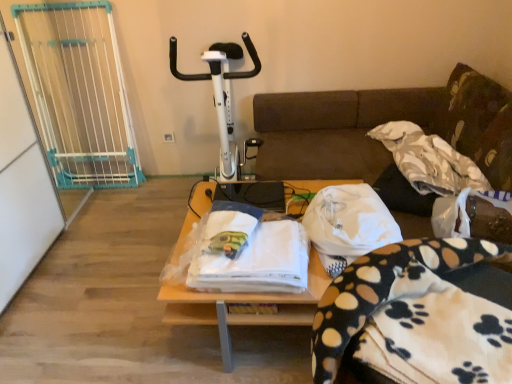
Question: Is the position of white plastic exercise bike at center more distant than that of white fabric at center?

Choices:
 (A) yes
 (B) no

Answer: (A)

Question: From the image's perspective, does white plastic exercise bike at center appear higher than white fabric at center?

Choices:
 (A) no
 (B) yes

Answer: (B)

Question: Is white plastic exercise bike at center outside of white fabric at center?

Choices:
 (A) yes
 (B) no

Answer: (A)

Question: Is white plastic exercise bike at center turned away from white fabric at center?

Choices:
 (A) yes
 (B) no

Answer: (B)

Question: Considering the relative sizes of white plastic exercise bike at center and white fabric at center in the image provided, is white plastic exercise bike at center wider than white fabric at center?

Choices:
 (A) no
 (B) yes

Answer: (B)

Question: Considering the positions of white fleece blanket at center, which is the first blanket from left to right, and white textured blanket at upper right, placed as the third blanket when sorted from front to back, in the image, is white fleece blanket at center, which is the first blanket from left to right, bigger or smaller than white textured blanket at upper right, placed as the third blanket when sorted from front to back,?

Choices:
 (A) small
 (B) big

Answer: (A)

Question: In the image, is white fleece blanket at center, which is the first blanket from left to right, on the left side or the right side of white textured blanket at upper right, which is the 3th blanket in left-to-right order?

Choices:
 (A) left
 (B) right

Answer: (A)

Question: From a real-world perspective, is white fleece blanket at center, which is the first blanket from left to right, positioned above or below white textured blanket at upper right, the 1th blanket in the right-to-left sequence?

Choices:
 (A) below
 (B) above

Answer: (A)

Question: Considering the positions of point [x=266, y=291] and point [x=393, y=142], is point [x=266, y=291] closer or farther from the camera than point [x=393, y=142]?

Choices:
 (A) closer
 (B) farther

Answer: (A)

Question: From the image's perspective, is wooden table at center located above or below white textured blanket at upper right, the 1th blanket in the right-to-left sequence?

Choices:
 (A) above
 (B) below

Answer: (B)

Question: Looking at the image, does wooden table at center seem bigger or smaller compared to white textured blanket at upper right, placed as the third blanket when sorted from front to back?

Choices:
 (A) big
 (B) small

Answer: (A)

Question: Is point (310, 190) closer or farther from the camera than point (403, 135)?

Choices:
 (A) farther
 (B) closer

Answer: (B)

Question: Do you think wooden table at center is within white textured blanket at upper right, the 1th blanket in the right-to-left sequence, or outside of it?

Choices:
 (A) inside
 (B) outside

Answer: (B)

Question: Is point (452, 89) closer or farther from the camera than point (350, 200)?

Choices:
 (A) farther
 (B) closer

Answer: (A)

Question: Is fluffy green pillow at upper right inside or outside of white fabric at center?

Choices:
 (A) inside
 (B) outside

Answer: (B)